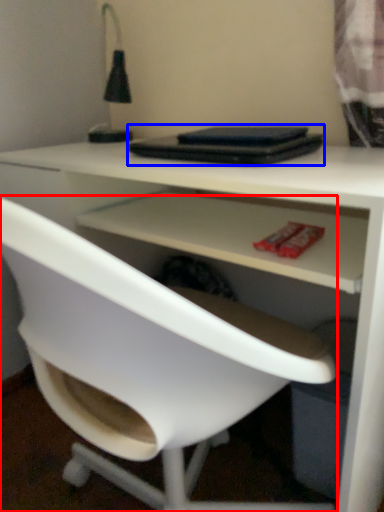
Question: Which object is further to the camera taking this photo, chair (highlighted by a red box) or laptop (highlighted by a blue box)?

Choices:
 (A) chair
 (B) laptop

Answer: (B)